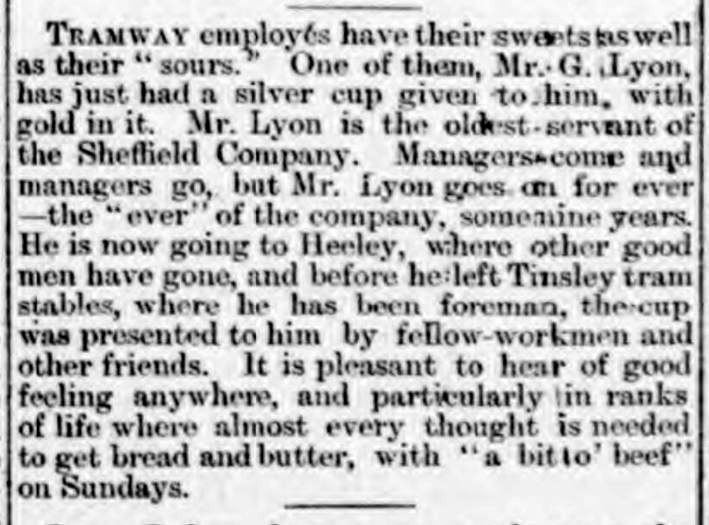
Locate an element on the screen. The image size is (709, 525). black bar on top of passage is located at coordinates click(283, 7), click(422, 10).